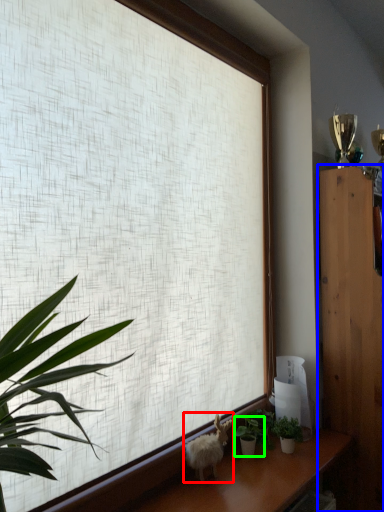
Question: Which is nearer to the animal (highlighted by a red box)? furniture (highlighted by a blue box) or houseplant (highlighted by a green box).

Choices:
 (A) furniture
 (B) houseplant

Answer: (B)